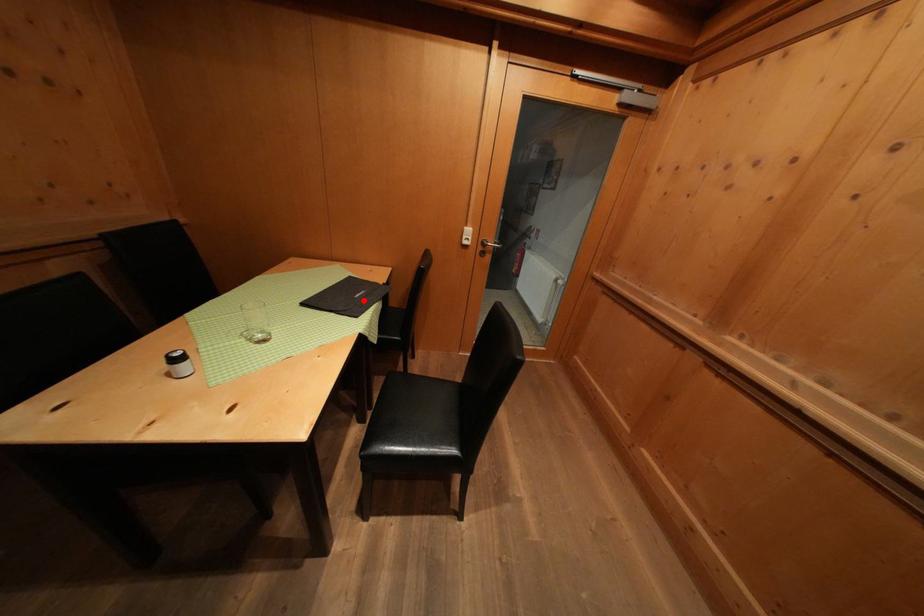
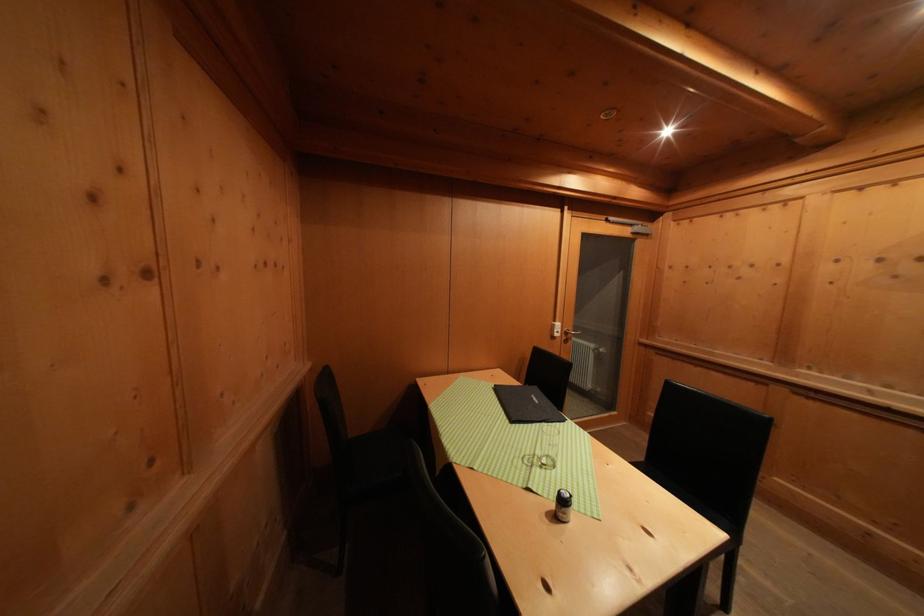
Question: I am providing you with two images of the same scene from different viewpoints. A red point is marked on the first image. At the location where the point appears in image 1, is it still visible in image 2?

Choices:
 (A) Yes
 (B) No

Answer: (A)